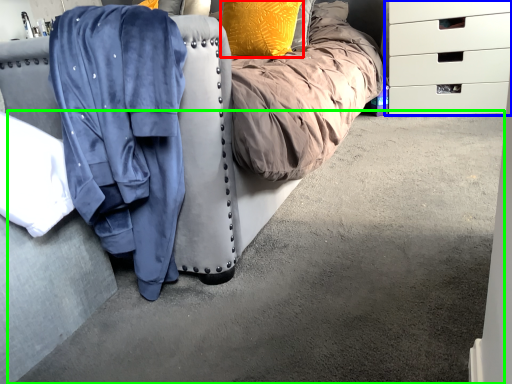
Question: Which is nearer to the pillow (highlighted by a red box)? chest of drawers (highlighted by a blue box) or concrete (highlighted by a green box).

Choices:
 (A) chest of drawers
 (B) concrete

Answer: (A)